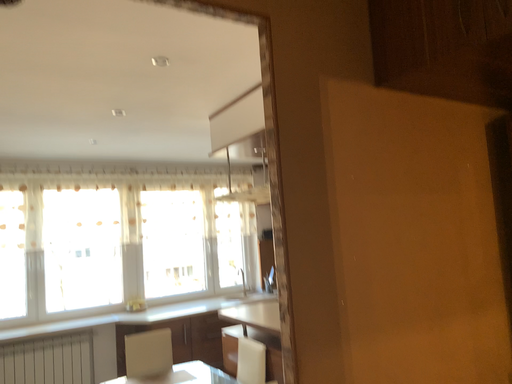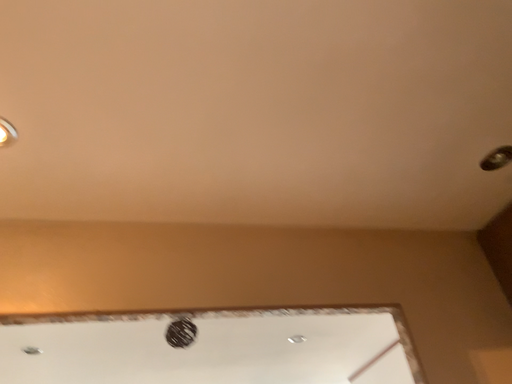
Question: How did the camera likely rotate when shooting the video?

Choices:
 (A) rotated left
 (B) rotated right

Answer: (A)